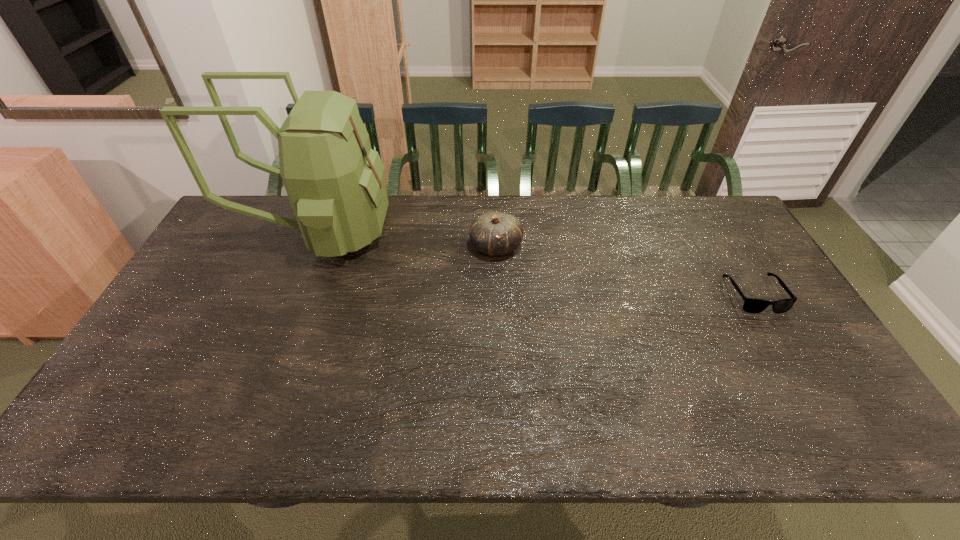
What are the coordinates of `gourd that is at the far edge` in the screenshot? It's located at (493, 233).

In order to click on object at the left edge in this screenshot , I will do `click(335, 182)`.

Find the location of a particular element. This screenshot has height=540, width=960. object positioned at the right edge is located at coordinates (751, 305).

Identify the location of object that is at the far left corner. The image size is (960, 540). (335, 182).

You are a GUI agent. You are given a task and a screenshot of the screen. Output one action in this format:
    pyautogui.click(x=<x>, y=<y>)
    Task: Click on the vacant space at the far edge
    
    Given the screenshot: What is the action you would take?
    pyautogui.click(x=643, y=214)

This screenshot has width=960, height=540. I want to click on free space at the near edge, so click(177, 429).

In the image, there is a desktop. Where is `free space at the left edge`? This screenshot has width=960, height=540. free space at the left edge is located at coordinates (184, 328).

I want to click on vacant region at the right edge of the desktop, so click(x=797, y=392).

In the image, there is a desktop. Where is `vacant space at the far left corner`? Image resolution: width=960 pixels, height=540 pixels. vacant space at the far left corner is located at coordinates (267, 226).

At what (x,y) coordinates should I click in order to perform the action: click on free space at the far right corner of the desktop. Please return your answer as a coordinate pair (x, y). Looking at the image, I should click on (x=707, y=195).